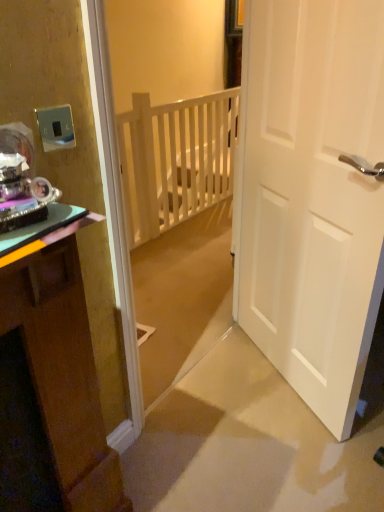
Image resolution: width=384 pixels, height=512 pixels. What do you see at coordinates (56, 127) in the screenshot?
I see `metallic silver switch at upper left` at bounding box center [56, 127].

Locate an element on the screen. white wooden balustrade at center is located at coordinates (175, 159).

This screenshot has height=512, width=384. Describe the element at coordinates (312, 195) in the screenshot. I see `white matte door at right` at that location.

Measure the distance between white matte door at right and camera.

A distance of 3.39 feet exists between white matte door at right and camera.

Describe the element at coordinates (63, 365) in the screenshot. I see `green glossy cabinet at left` at that location.

Locate an element on the screen. This screenshot has height=512, width=384. metallic silver switch at upper left is located at coordinates (56, 127).

Is white wooden balustrade at center far away from metallic silver switch at upper left?

Yes, white wooden balustrade at center and metallic silver switch at upper left are quite far apart.

Considering the relative sizes of white wooden balustrade at center and metallic silver switch at upper left in the image provided, is white wooden balustrade at center smaller than metallic silver switch at upper left?

No, white wooden balustrade at center is not smaller than metallic silver switch at upper left.

Is white wooden balustrade at center at the right side of metallic silver switch at upper left?

Yes, white wooden balustrade at center is to the right of metallic silver switch at upper left.

Which is farther, (167, 136) or (69, 131)?

Point (167, 136)

Can you confirm if metallic silver switch at upper left is wider than white matte door at right?

In fact, metallic silver switch at upper left might be narrower than white matte door at right.

Is metallic silver switch at upper left oriented away from white matte door at right?

metallic silver switch at upper left does not have its back to white matte door at right.

Consider the image. Would you say metallic silver switch at upper left is outside white matte door at right?

metallic silver switch at upper left lies outside white matte door at right's area.

Visually, is metallic silver switch at upper left positioned to the left or to the right of white matte door at right?

From the image, it's evident that metallic silver switch at upper left is to the left of white matte door at right.

Looking at this image, is green glossy cabinet at left inside or outside of white wooden balustrade at center?

green glossy cabinet at left is not enclosed by white wooden balustrade at center.

Which of these two, green glossy cabinet at left or white wooden balustrade at center, is bigger?

white wooden balustrade at center is bigger.

From a real-world perspective, is green glossy cabinet at left positioned under white wooden balustrade at center based on gravity?

No, from a real-world perspective, green glossy cabinet at left is not beneath white wooden balustrade at center.

Is white matte door at right facing away from green glossy cabinet at left?

No, white matte door at right is not facing away from green glossy cabinet at left.

Is white matte door at right in front of green glossy cabinet at left?

No, the depth of white matte door at right is greater than that of green glossy cabinet at left.

Is white matte door at right thinner than green glossy cabinet at left?

Yes, white matte door at right is thinner than green glossy cabinet at left.

From the image's perspective, is green glossy cabinet at left beneath metallic silver switch at upper left?

Yes, from the image's perspective, green glossy cabinet at left is beneath metallic silver switch at upper left.

Which of these two, green glossy cabinet at left or metallic silver switch at upper left, is bigger?

green glossy cabinet at left.

Is green glossy cabinet at left in contact with metallic silver switch at upper left?

They are not placed beside each other.

Between green glossy cabinet at left and metallic silver switch at upper left, which one has more height?

green glossy cabinet at left.

In the image, is white wooden balustrade at center on the left side or the right side of white matte door at right?

white wooden balustrade at center is positioned on white matte door at right's left side.

Is white matte door at right at the back of white wooden balustrade at center?

No, white matte door at right is not at the back of white wooden balustrade at center.

Which of these two, white wooden balustrade at center or white matte door at right, is smaller?

With smaller size is white matte door at right.

At what (x,y) coordinates should I click in order to perform the action: click on balustrade on the left of white matte door at right. Please return your answer as a coordinate pair (x, y). Looking at the image, I should click on (175, 159).

Considering the sizes of objects metallic silver switch at upper left and white wooden balustrade at center in the image provided, who is smaller, metallic silver switch at upper left or white wooden balustrade at center?

metallic silver switch at upper left is smaller.

Looking at this image, from a real-world perspective, between metallic silver switch at upper left and white wooden balustrade at center, who is vertically lower?

In real-world perspective, white wooden balustrade at center is lower.

Would you consider metallic silver switch at upper left to be distant from white wooden balustrade at center?

metallic silver switch at upper left is positioned a significant distance from white wooden balustrade at center.

Where is `balustrade that appears behind the metallic silver switch at upper left`? The image size is (384, 512). balustrade that appears behind the metallic silver switch at upper left is located at coordinates (175, 159).

Identify the location of electric outlet on the left of white matte door at right. The image size is (384, 512). (56, 127).

Which object lies nearer to the anchor point white wooden balustrade at center, white matte door at right or green glossy cabinet at left?

white matte door at right is positioned closer to the anchor white wooden balustrade at center.

Considering their positions, is white wooden balustrade at center positioned closer to metallic silver switch at upper left than green glossy cabinet at left?

The object closer to metallic silver switch at upper left is green glossy cabinet at left.

Estimate the real-world distances between objects in this image. Which object is closer to white matte door at right, white wooden balustrade at center or green glossy cabinet at left?

green glossy cabinet at left is positioned closer to the anchor white matte door at right.

Which object lies further to the anchor point white wooden balustrade at center, metallic silver switch at upper left or green glossy cabinet at left?

metallic silver switch at upper left.

Estimate the real-world distances between objects in this image. Which object is closer to green glossy cabinet at left, white wooden balustrade at center or metallic silver switch at upper left?

Based on the image, metallic silver switch at upper left appears to be nearer to green glossy cabinet at left.

Considering their positions, is white wooden balustrade at center positioned closer to metallic silver switch at upper left than white matte door at right?

Among the two, white matte door at right is located nearer to metallic silver switch at upper left.

Which object lies further to the anchor point white wooden balustrade at center, metallic silver switch at upper left or white matte door at right?

metallic silver switch at upper left.

Based on their spatial positions, is green glossy cabinet at left or metallic silver switch at upper left closer to white wooden balustrade at center?

green glossy cabinet at left is positioned closer to the anchor white wooden balustrade at center.

Locate an element on the screen. This screenshot has width=384, height=512. electric outlet positioned between green glossy cabinet at left and white wooden balustrade at center from near to far is located at coordinates click(x=56, y=127).

Where is `electric outlet between green glossy cabinet at left and white matte door at right from left to right`? This screenshot has height=512, width=384. electric outlet between green glossy cabinet at left and white matte door at right from left to right is located at coordinates (56, 127).

Where is `door located between green glossy cabinet at left and white wooden balustrade at center in the depth direction`? Image resolution: width=384 pixels, height=512 pixels. door located between green glossy cabinet at left and white wooden balustrade at center in the depth direction is located at coordinates (312, 195).

The width and height of the screenshot is (384, 512). I want to click on electric outlet positioned between white matte door at right and white wooden balustrade at center from near to far, so click(x=56, y=127).